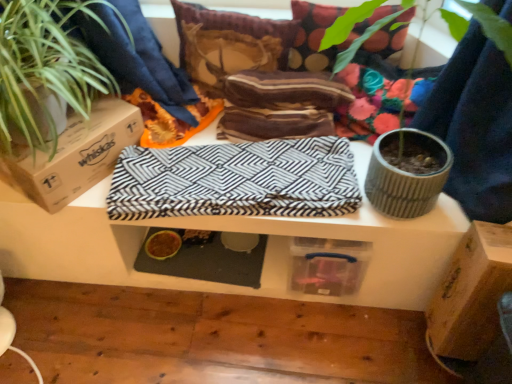
Question: Which is correct: green leafy plant at left is inside brown cardboard box at lower right, which is the first cardboard box from right to left, or outside of it?

Choices:
 (A) outside
 (B) inside

Answer: (A)

Question: In the image, is green leafy plant at left on the left side or the right side of brown cardboard box at lower right, acting as the second cardboard box starting from the top?

Choices:
 (A) left
 (B) right

Answer: (A)

Question: Which object is positioned farthest from the green leafy plant at left?

Choices:
 (A) striped fabric pillow at upper center, placed as the second pillow when sorted from right to left
 (B) black and white zigzag fabric at center
 (C) brown cardboard box at lower right, which is counted as the 2th cardboard box, starting from the left
 (D) yellow rubber food bowl at lower center
 (E) multicolored fabric pillow at upper center, arranged as the first pillow when viewed from the right

Answer: (C)

Question: Which of these objects is positioned closest to the green leafy plant at left?

Choices:
 (A) black and white zigzag fabric at center
 (B) multicolored fabric pillow at upper center, arranged as the first pillow when viewed from the right
 (C) striped fabric pillow at upper center, placed as the second pillow when sorted from right to left
 (D) brown cardboard box at left, marked as the 1th cardboard box in a top-to-bottom arrangement
 (E) brown cardboard box at lower right, which appears as the 1th cardboard box when ordered from the bottom

Answer: (D)